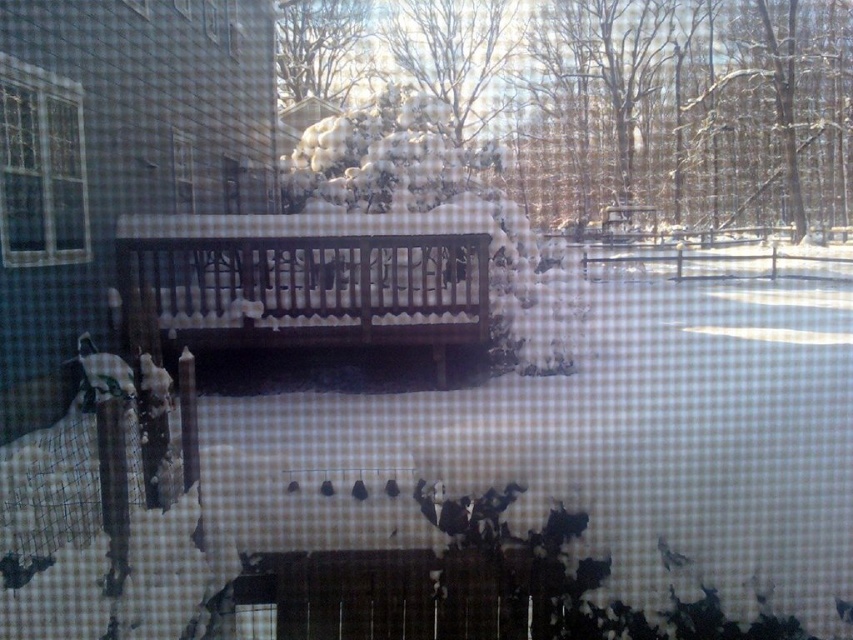
You are trying to decide whether to sit on the dark brown wood bench at center or look through the clear glass window at upper left. Which object would you choose if you want to sit down?

The dark brown wood bench at center is bigger than the clear glass window at upper left, so it is more suitable for sitting down.

You are standing on the wooden deck and looking through the window with the checkered pattern. You notice the white fluffy snow at upper center and the brown wooden rail at center. Which object is closer to you, the observer?

The white fluffy snow at upper center is closer to you because the brown wooden rail at center is behind it.